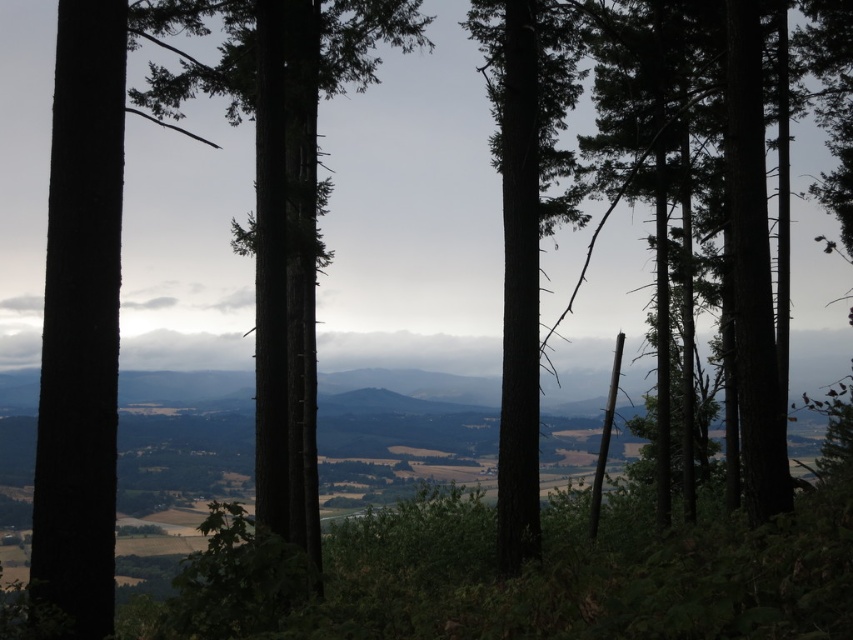
You are a hiker standing in the forest and want to find the tallest tree between the dark green bark tree at center and the smooth bark tree at center. Which tree should you look up to?

The smooth bark tree at center is taller than the dark green bark tree at center, so you should look up at the smooth bark tree at center.

You are an environmental scientist assessing the forest composition. You notice two trees at the center of the scene, the dark green bark tree at center and the smooth bark tree at center. Which of these trees has a greater height?

The dark green bark tree at center is larger in size than the smooth bark tree at center, so it has a greater height.